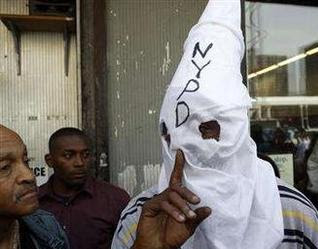
This screenshot has width=318, height=249. In order to click on brackets in this screenshot , I will do `click(18, 44)`, `click(65, 48)`.